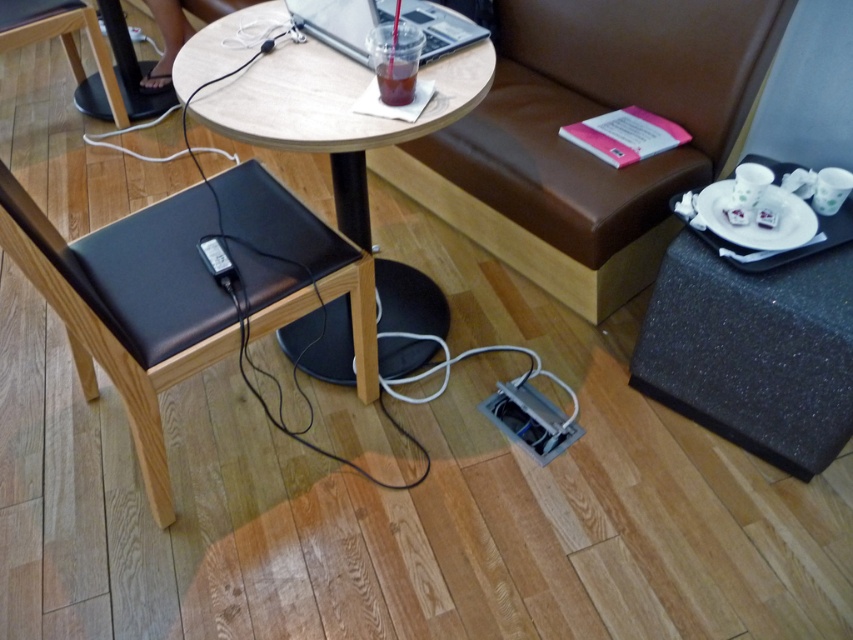
Can you confirm if wooden table at center is wider than translucent plastic cup at center?

Indeed, wooden table at center has a greater width compared to translucent plastic cup at center.

Who is higher up, wooden table at center or translucent plastic cup at center?

translucent plastic cup at center

The image size is (853, 640). What do you see at coordinates (335, 113) in the screenshot?
I see `wooden table at center` at bounding box center [335, 113].

The width and height of the screenshot is (853, 640). What are the coordinates of `wooden table at center` in the screenshot? It's located at (335, 113).

Who is positioned more to the right, black textured tray at right or wooden table at center?

black textured tray at right

Does black textured tray at right have a lesser width compared to wooden table at center?

Yes.

Who is more distant from viewer, (776, 460) or (428, 67)?

Point (776, 460)

This screenshot has width=853, height=640. What are the coordinates of `black textured tray at right` in the screenshot? It's located at tap(755, 344).

Which is above, silver metallic laptop at center or translucent plastic cup at center?

Positioned higher is silver metallic laptop at center.

From the picture: Who is lower down, silver metallic laptop at center or translucent plastic cup at center?

translucent plastic cup at center is lower down.

Between point (433, 3) and point (395, 99), which one is positioned behind?

Point (433, 3)

Where is `silver metallic laptop at center`? The width and height of the screenshot is (853, 640). silver metallic laptop at center is located at coordinates (341, 22).